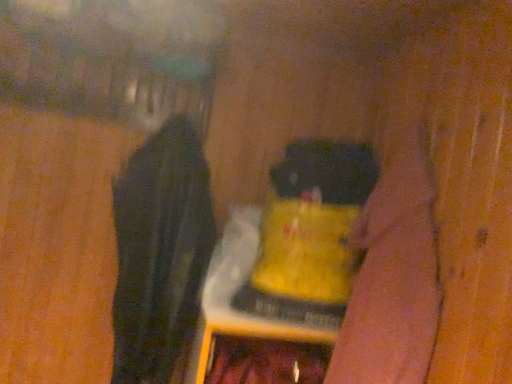
Question: Does black fabric at left come in front of velvety black cat at center?

Choices:
 (A) no
 (B) yes

Answer: (B)

Question: Is black fabric at left wider than velvety black cat at center?

Choices:
 (A) yes
 (B) no

Answer: (A)

Question: Is velvety black cat at center at the back of black fabric at left?

Choices:
 (A) no
 (B) yes

Answer: (A)

Question: Can you confirm if black fabric at left is positioned to the right of velvety black cat at center?

Choices:
 (A) no
 (B) yes

Answer: (A)

Question: Can you confirm if black fabric at left is smaller than velvety black cat at center?

Choices:
 (A) yes
 (B) no

Answer: (B)

Question: From a real-world perspective, is yellow matte bottle at center positioned above or below black fabric at left?

Choices:
 (A) above
 (B) below

Answer: (A)

Question: Would you say yellow matte bottle at center is to the left or to the right of black fabric at left in the picture?

Choices:
 (A) left
 (B) right

Answer: (B)

Question: Considering the positions of yellow matte bottle at center and black fabric at left in the image, is yellow matte bottle at center bigger or smaller than black fabric at left?

Choices:
 (A) small
 (B) big

Answer: (A)

Question: Considering their positions, is yellow matte bottle at center located in front of or behind black fabric at left?

Choices:
 (A) front
 (B) behind

Answer: (B)

Question: Is yellow matte bottle at center inside the boundaries of velvety black cat at center, or outside?

Choices:
 (A) outside
 (B) inside

Answer: (A)

Question: Considering the positions of yellow matte bottle at center and velvety black cat at center in the image, is yellow matte bottle at center taller or shorter than velvety black cat at center?

Choices:
 (A) short
 (B) tall

Answer: (B)

Question: From the image's perspective, is yellow matte bottle at center located above or below velvety black cat at center?

Choices:
 (A) below
 (B) above

Answer: (A)

Question: In terms of width, does yellow matte bottle at center look wider or thinner when compared to velvety black cat at center?

Choices:
 (A) thin
 (B) wide

Answer: (B)

Question: Which is correct: black fabric at left is inside yellow matte bottle at center, or outside of it?

Choices:
 (A) outside
 (B) inside

Answer: (A)

Question: From a real-world perspective, is black fabric at left physically located above or below yellow matte bottle at center?

Choices:
 (A) below
 (B) above

Answer: (A)